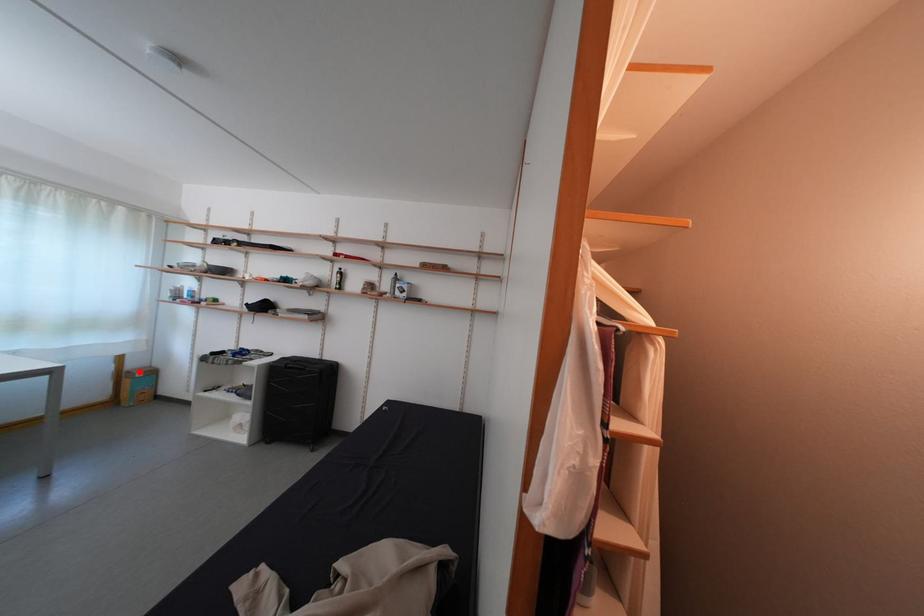
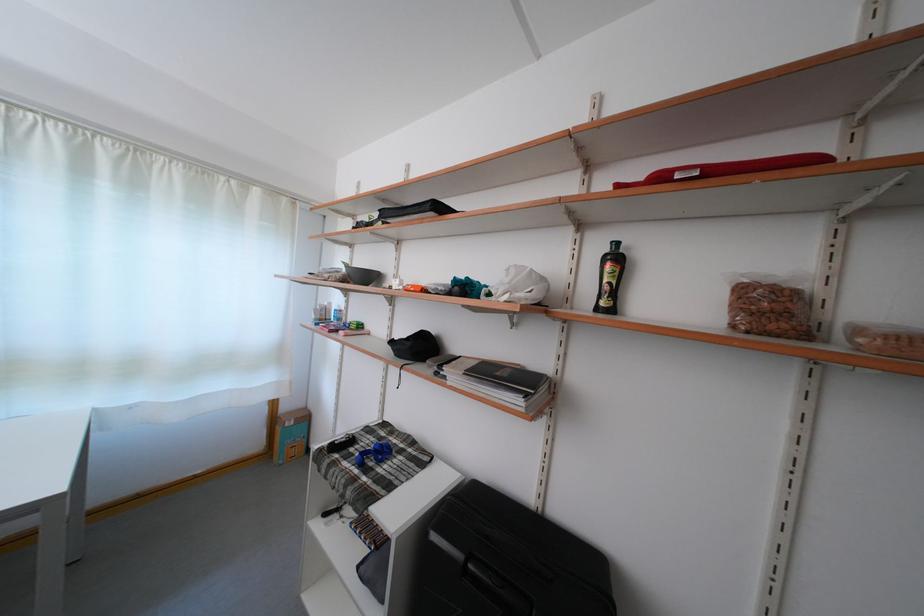
Question: I am providing you with two images of the same scene from different viewpoints. In image1, a red point is highlighted. Considering the same 3D point in image2, which of the following is correct?

Choices:
 (A) It is closer
 (B) It is farther

Answer: (B)